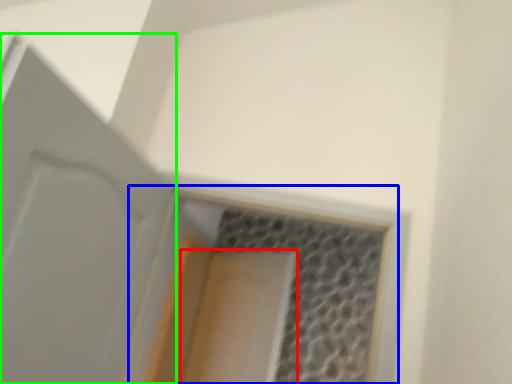
Question: Based on their relative distances, which object is farther from screen door (highlighted by a red box)? Choose from window (highlighted by a blue box) and door (highlighted by a green box).

Choices:
 (A) window
 (B) door

Answer: (B)